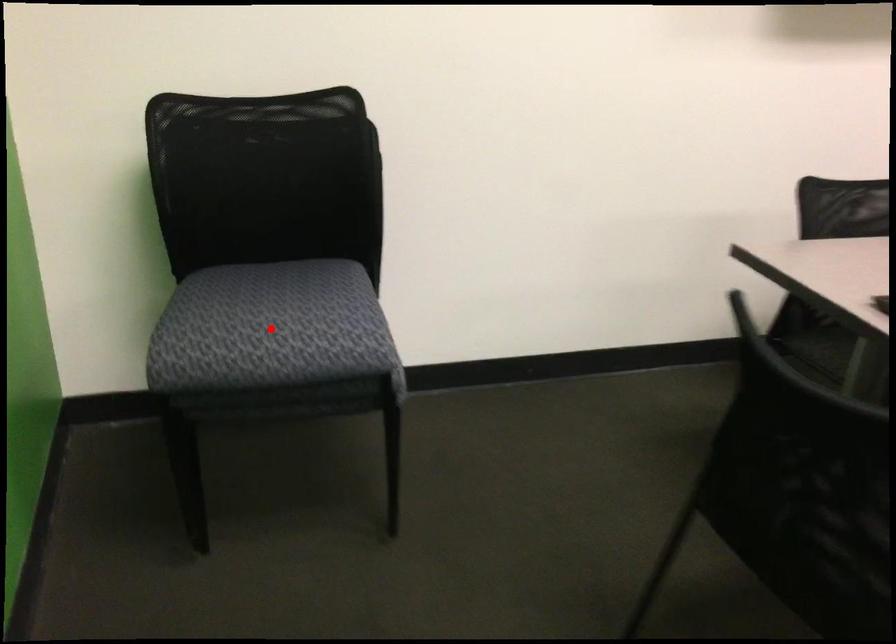
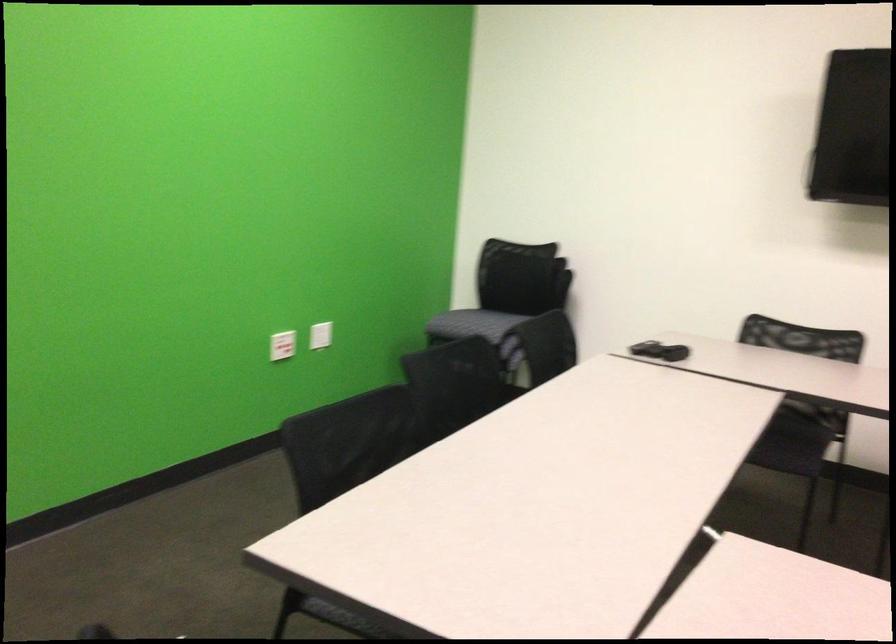
Question: A red point is marked in image1. In image2, is the corresponding 3D point closer to the camera or farther? Reply with the corresponding letter.

Choices:
 (A) The corresponding 3D point is closer.
 (B) The corresponding 3D point is farther.

Answer: (B)